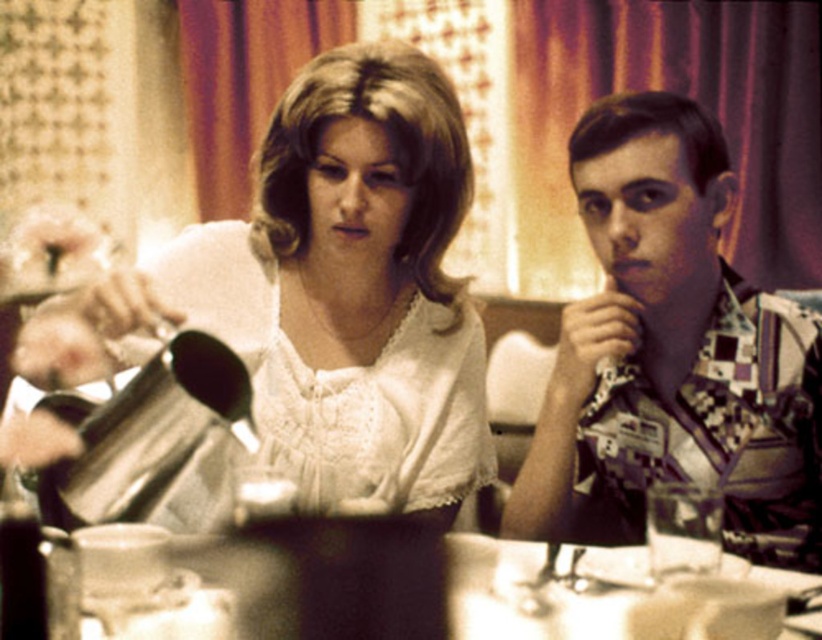
Between white lace blouse at center and metallic silver tray at center, which one appears on the right side from the viewer's perspective?

metallic silver tray at center

Is white lace blouse at center above metallic silver tray at center?

Correct, white lace blouse at center is located above metallic silver tray at center.

Between point (363, 448) and point (84, 620), which one is positioned in front?

Positioned in front is point (84, 620).

Where is `white lace blouse at center`? The width and height of the screenshot is (822, 640). white lace blouse at center is located at coordinates (299, 317).

Is point (405, 305) positioned after point (672, 419)?

Yes, point (405, 305) is behind point (672, 419).

Who is taller, white lace blouse at center or printed cotton shirt at right?

white lace blouse at center

The width and height of the screenshot is (822, 640). Find the location of `white lace blouse at center`. white lace blouse at center is located at coordinates (299, 317).

Find the location of a particular element. The height and width of the screenshot is (640, 822). white lace blouse at center is located at coordinates (299, 317).

Does printed cotton shirt at right appear over metallic silver tray at center?

Correct, printed cotton shirt at right is located above metallic silver tray at center.

You are a GUI agent. You are given a task and a screenshot of the screen. Output one action in this format:
    pyautogui.click(x=<x>, y=<y>)
    Task: Click on the printed cotton shirt at right
    Image resolution: width=822 pixels, height=640 pixels.
    Given the screenshot: What is the action you would take?
    pyautogui.click(x=672, y=355)